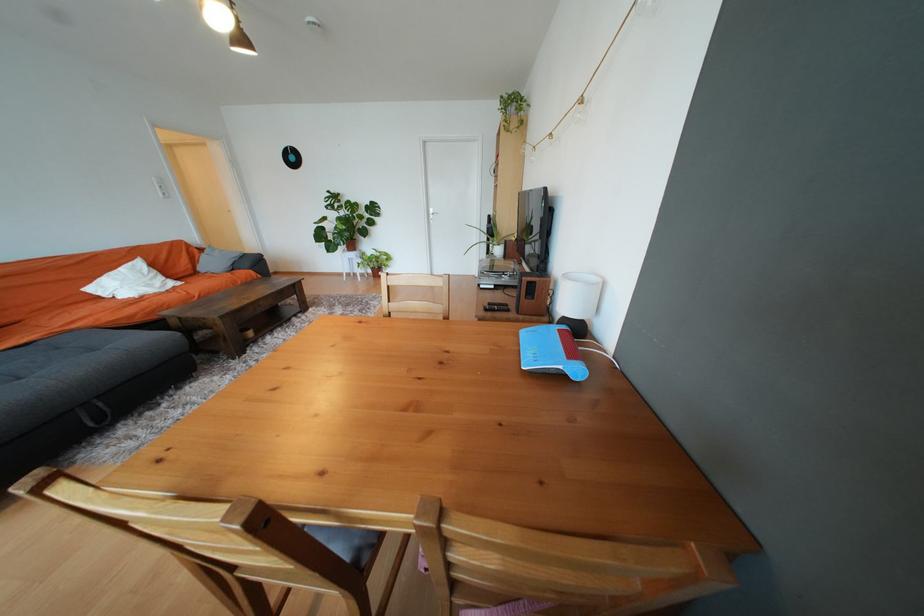
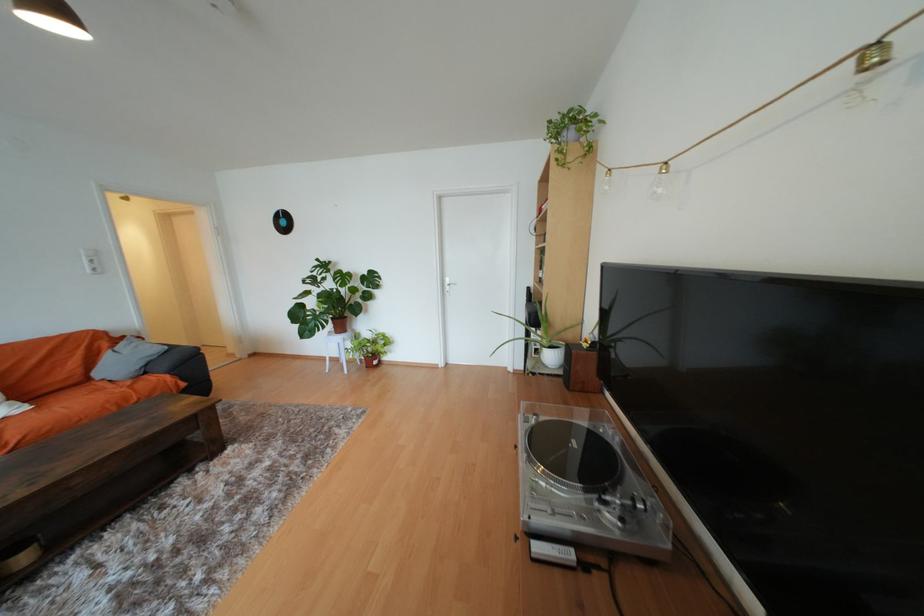
Where in the second image is the point corresponding to pixel 393 256 from the first image?

(391, 339)